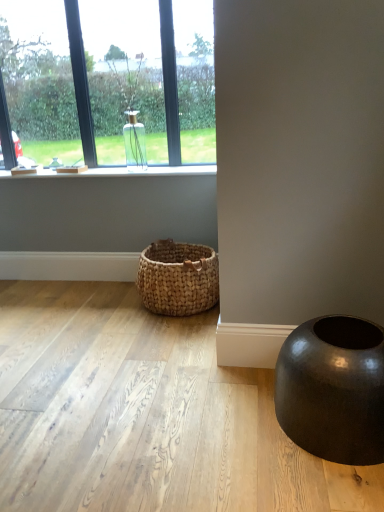
Question: Considering the positions of point (135, 141) and point (155, 132), is point (135, 141) closer or farther from the camera than point (155, 132)?

Choices:
 (A) farther
 (B) closer

Answer: (A)

Question: Is clear glass vase at upper left, which is the 2th window in right-to-left order, spatially inside clear glass vase at upper left, the 2th window when ordered from left to right, or outside of it?

Choices:
 (A) inside
 (B) outside

Answer: (B)

Question: Considering the real-world distances, which object is closest to the clear glass vase at upper left, the 2th window when ordered from left to right?

Choices:
 (A) clear glass vase at upper left, which is the 1th window from left to right
 (B) shiny black vase at lower right
 (C) clear glass vase at upper left
 (D) woven natural basket at lower center

Answer: (A)

Question: Estimate the real-world distances between objects in this image. Which object is closer to the clear glass vase at upper left, the 2th window when ordered from left to right?

Choices:
 (A) shiny black vase at lower right
 (B) clear glass vase at upper left
 (C) clear glass vase at upper left, which is the 1th window from left to right
 (D) woven natural basket at lower center

Answer: (C)